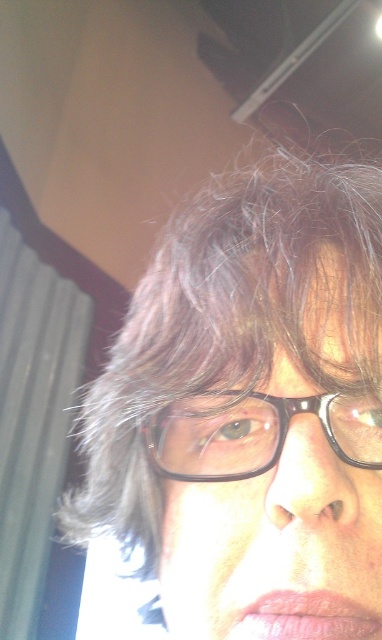
What do you see at coordinates (250, 410) in the screenshot?
I see `brown matte hair at center` at bounding box center [250, 410].

Who is more forward, [210,454] or [357,433]?

Point [357,433] is in front.

The height and width of the screenshot is (640, 382). What are the coordinates of `brown matte hair at center` in the screenshot? It's located at (250, 410).